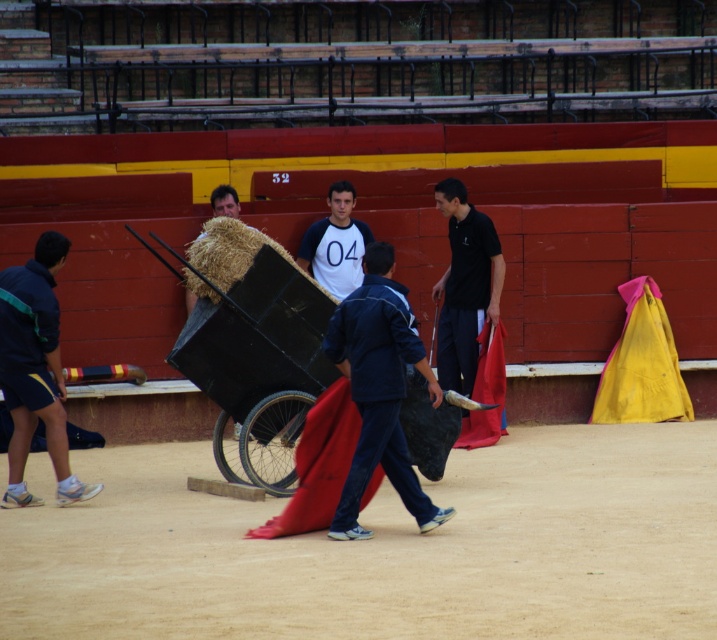
Does blue fabric at center appear over white cotton shirt at center?

No, blue fabric at center is not above white cotton shirt at center.

Between blue fabric at center and white cotton shirt at center, which one appears on the right side from the viewer's perspective?

From the viewer's perspective, blue fabric at center appears more on the right side.

Is point (394, 346) farther from viewer compared to point (326, 269)?

No.

The height and width of the screenshot is (640, 717). I want to click on blue fabric at center, so (379, 388).

Who is positioned more to the left, blue fabric shorts at lower left or black smooth shirt at center?

blue fabric shorts at lower left

Between point (23, 445) and point (442, 369), which one is positioned in front?

Point (23, 445) is more forward.

Does point (9, 346) come in front of point (500, 260)?

That is True.

Where is `blue fabric shorts at lower left`? The image size is (717, 640). blue fabric shorts at lower left is located at coordinates (34, 371).

Which of these two, black smooth shirt at center or white cotton shirt at center, stands taller?

With more height is black smooth shirt at center.

Measure the distance from black smooth shirt at center to white cotton shirt at center.

black smooth shirt at center is 34.40 inches from white cotton shirt at center.

Between point (483, 275) and point (341, 214), which one is positioned behind?

Point (341, 214)

The width and height of the screenshot is (717, 640). In order to click on black smooth shirt at center in this screenshot , I will do `click(465, 285)`.